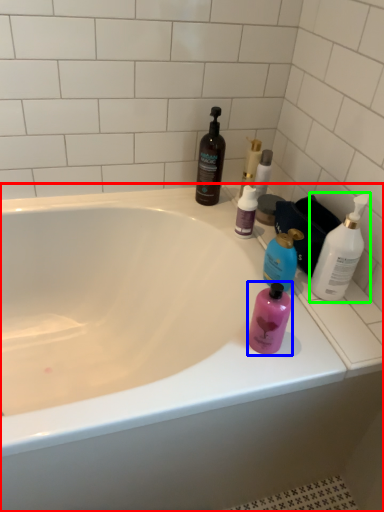
Question: Which object is positioned closest to bathtub (highlighted by a red box)? Select from bottle (highlighted by a blue box) and bottle (highlighted by a green box).

Choices:
 (A) bottle
 (B) bottle

Answer: (A)